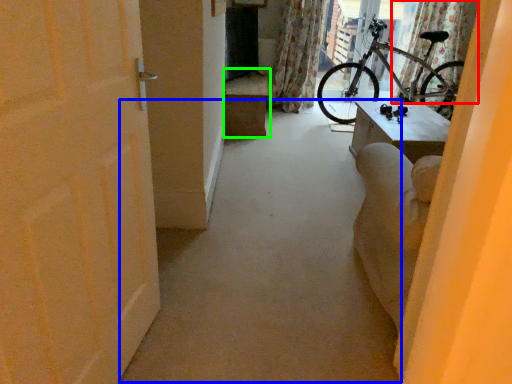
Question: Estimate the real-world distances between objects in this image. Which object is closer to curtain (highlighted by a red box), alley (highlighted by a blue box) or furniture (highlighted by a green box)?

Choices:
 (A) alley
 (B) furniture

Answer: (B)